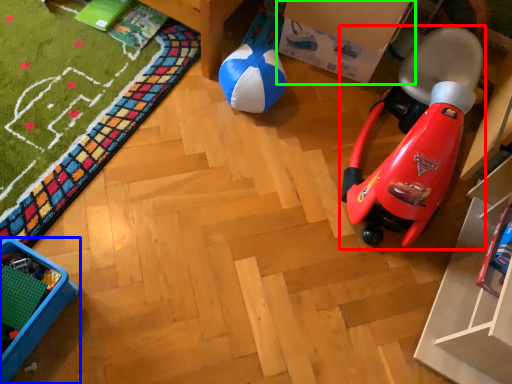
Question: Estimate the real-world distances between objects in this image. Which object is closer to toy (highlighted by a red box), furniture (highlighted by a blue box) or cardboard box (highlighted by a green box)?

Choices:
 (A) furniture
 (B) cardboard box

Answer: (B)